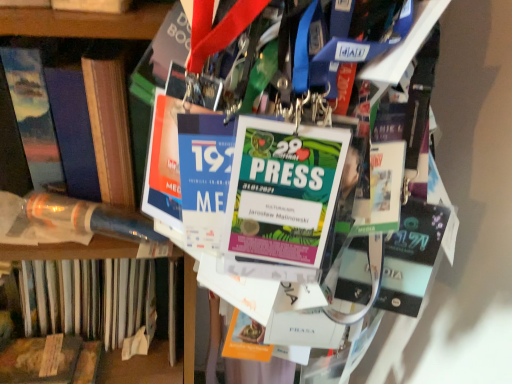
Question: Is the surface of hardcover book at left, the first book when ordered from right to left, in direct contact with matte blue book at left, the 2th book in the right-to-left sequence?

Choices:
 (A) no
 (B) yes

Answer: (B)

Question: Is hardcover book at left, arranged as the 4th book when viewed from the left, to the left of matte blue book at left, the 2th book in the right-to-left sequence, from the viewer's perspective?

Choices:
 (A) yes
 (B) no

Answer: (B)

Question: Considering the relative positions of hardcover book at left, arranged as the 4th book when viewed from the left, and matte blue book at left, positioned as the 3th book in left-to-right order, in the image provided, is hardcover book at left, arranged as the 4th book when viewed from the left, to the right of matte blue book at left, positioned as the 3th book in left-to-right order, from the viewer's perspective?

Choices:
 (A) no
 (B) yes

Answer: (B)

Question: Considering the relative positions of hardcover book at left, arranged as the 4th book when viewed from the left, and matte blue book at left, the 2th book in the right-to-left sequence, in the image provided, is hardcover book at left, arranged as the 4th book when viewed from the left, behind matte blue book at left, the 2th book in the right-to-left sequence,?

Choices:
 (A) no
 (B) yes

Answer: (A)

Question: Could you tell me if hardcover book at left, arranged as the 4th book when viewed from the left, is facing matte blue book at left, positioned as the 3th book in left-to-right order?

Choices:
 (A) yes
 (B) no

Answer: (B)

Question: Do you think hardcover book at left, arranged as the 4th book when viewed from the left, is within translucent plastic tube at left, the third book viewed from the right, or outside of it?

Choices:
 (A) outside
 (B) inside

Answer: (A)

Question: From the image's perspective, is hardcover book at left, the first book when ordered from right to left, positioned above or below translucent plastic tube at left, which appears as the second book when viewed from the left?

Choices:
 (A) below
 (B) above

Answer: (B)

Question: In the image, is hardcover book at left, the first book when ordered from right to left, on the left side or the right side of translucent plastic tube at left, which appears as the second book when viewed from the left?

Choices:
 (A) right
 (B) left

Answer: (A)

Question: In terms of width, does hardcover book at left, the first book when ordered from right to left, look wider or thinner when compared to translucent plastic tube at left, the third book viewed from the right?

Choices:
 (A) thin
 (B) wide

Answer: (B)

Question: From the image's perspective, is wooden plank at lower left, which is the fourth book in right-to-left order, above or below hardcover book at left, arranged as the 4th book when viewed from the left?

Choices:
 (A) above
 (B) below

Answer: (B)

Question: Considering the positions of wooden plank at lower left, which is the fourth book in right-to-left order, and hardcover book at left, the first book when ordered from right to left, in the image, is wooden plank at lower left, which is the fourth book in right-to-left order, taller or shorter than hardcover book at left, the first book when ordered from right to left,?

Choices:
 (A) short
 (B) tall

Answer: (A)

Question: In the image, is wooden plank at lower left, arranged as the first book when viewed from the left, positioned in front of or behind hardcover book at left, arranged as the 4th book when viewed from the left?

Choices:
 (A) front
 (B) behind

Answer: (B)

Question: From a real-world perspective, relative to hardcover book at left, the first book when ordered from right to left, is wooden plank at lower left, which is the fourth book in right-to-left order, vertically above or below?

Choices:
 (A) below
 (B) above

Answer: (A)

Question: Is hardcover book at left, the first book when ordered from right to left, wider or thinner than matte blue book at left, positioned as the 3th book in left-to-right order?

Choices:
 (A) wide
 (B) thin

Answer: (A)

Question: Considering the relative positions of hardcover book at left, the first book when ordered from right to left, and matte blue book at left, positioned as the 3th book in left-to-right order, in the image provided, is hardcover book at left, the first book when ordered from right to left, to the left or to the right of matte blue book at left, positioned as the 3th book in left-to-right order,?

Choices:
 (A) right
 (B) left

Answer: (A)